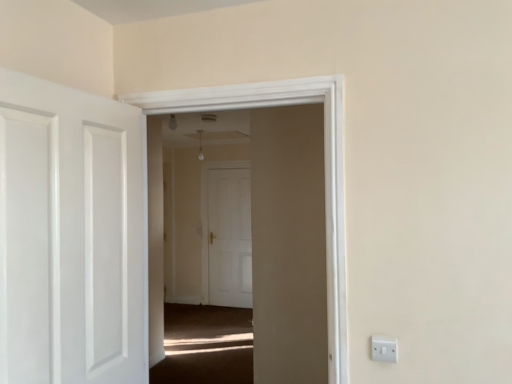
What is the approximate width of white plastic switch at lower right?

white plastic switch at lower right is 0.56 inches wide.

The image size is (512, 384). Identify the location of white matte door at center, the 2th door viewed from the front. (229, 237).

Is white glossy door at left, the 2th door from the back, aimed at white matte door at center, the 1th door viewed from the back?

No, white glossy door at left, the 2th door from the back, is not facing towards white matte door at center, the 1th door viewed from the back.

From the image's perspective, does white glossy door at left, which is the 1th door from front to back, appear lower than white matte door at center, the 2th door viewed from the front?

No, from the image's perspective, white glossy door at left, which is the 1th door from front to back, is not below white matte door at center, the 2th door viewed from the front.

In the scene shown: Can you confirm if white glossy door at left, the 2th door from the back, is positioned to the right of white matte door at center, the 2th door viewed from the front?

In fact, white glossy door at left, the 2th door from the back, is to the left of white matte door at center, the 2th door viewed from the front.

Considering the sizes of objects white glossy door at left, the 2th door from the back, and white matte door at center, the 1th door viewed from the back, in the image provided, who is thinner, white glossy door at left, the 2th door from the back, or white matte door at center, the 1th door viewed from the back,?

With smaller width is white matte door at center, the 1th door viewed from the back.

Consider the image. Between transparent glass door at center and white glossy door at left, which is the 1th door from front to back, which one has larger size?

With larger size is white glossy door at left, which is the 1th door from front to back.

This screenshot has width=512, height=384. Identify the location of window that appears on the right of white glossy door at left, which is the 1th door from front to back. (325, 166).

Can you tell me how much transparent glass door at center and white glossy door at left, the 2th door from the back, differ in facing direction?

90.8 degrees separate the facing orientations of transparent glass door at center and white glossy door at left, the 2th door from the back.

Considering the positions of point (217, 107) and point (77, 103), is point (217, 107) closer or farther from the camera than point (77, 103)?

Point (217, 107) is farther from the camera than point (77, 103).

Is transparent glass door at center a part of white matte door at center, the 2th door viewed from the front?

No, white matte door at center, the 2th door viewed from the front, does not contain transparent glass door at center.

From the picture: Who is bigger, white matte door at center, the 1th door viewed from the back, or transparent glass door at center?

With larger size is transparent glass door at center.

Which object is more forward, white matte door at center, the 2th door viewed from the front, or transparent glass door at center?

Positioned in front is transparent glass door at center.

What's the angular difference between white matte door at center, the 2th door viewed from the front, and transparent glass door at center's facing directions?

There is a 0.157-degree angle between the facing directions of white matte door at center, the 2th door viewed from the front, and transparent glass door at center.

Could white plastic switch at lower right be considered to be inside transparent glass door at center?

No, white plastic switch at lower right is not a part of transparent glass door at center.

Which object is positioned more to the left, transparent glass door at center or white plastic switch at lower right?

From the viewer's perspective, transparent glass door at center appears more on the left side.

Who is shorter, transparent glass door at center or white plastic switch at lower right?

Standing shorter between the two is white plastic switch at lower right.

How many degrees apart are the facing directions of transparent glass door at center and white plastic switch at lower right?

There is a 0.485-degree angle between the facing directions of transparent glass door at center and white plastic switch at lower right.

Considering the sizes of objects transparent glass door at center and white matte door at center, the 2th door viewed from the front, in the image provided, who is shorter, transparent glass door at center or white matte door at center, the 2th door viewed from the front,?

Standing shorter between the two is transparent glass door at center.

Between point (285, 92) and point (212, 254), which one is positioned behind?

Positioned behind is point (212, 254).

Is transparent glass door at center aimed at white matte door at center, the 1th door viewed from the back?

No, transparent glass door at center is not aimed at white matte door at center, the 1th door viewed from the back.

Is transparent glass door at center beside white matte door at center, the 2th door viewed from the front?

They are not placed beside each other.

Considering the positions of objects white matte door at center, the 1th door viewed from the back, and white glossy door at left, which is the 1th door from front to back, in the image provided, who is in front, white matte door at center, the 1th door viewed from the back, or white glossy door at left, which is the 1th door from front to back,?

white glossy door at left, which is the 1th door from front to back, is more forward.

Does point (212, 274) appear closer or farther from the camera than point (8, 378)?

Point (212, 274) is positioned farther from the camera compared to point (8, 378).

Would you consider white matte door at center, the 2th door viewed from the front, to be distant from white glossy door at left, the 2th door from the back?

Yes, white matte door at center, the 2th door viewed from the front, and white glossy door at left, the 2th door from the back, are quite far apart.

Is white matte door at center, the 2th door viewed from the front, not within white plastic switch at lower right?

Yes, white matte door at center, the 2th door viewed from the front, is outside of white plastic switch at lower right.

Is white matte door at center, the 2th door viewed from the front, thinner than white plastic switch at lower right?

Incorrect, the width of white matte door at center, the 2th door viewed from the front, is not less than that of white plastic switch at lower right.

You are a GUI agent. You are given a task and a screenshot of the screen. Output one action in this format:
    pyautogui.click(x=<x>, y=<y>)
    Task: Click on the electric outlet that is above the white matte door at center, the 2th door viewed from the front (from a real-world perspective)
    
    Given the screenshot: What is the action you would take?
    pyautogui.click(x=384, y=349)

How distant is white matte door at center, the 1th door viewed from the back, from white plastic switch at lower right?

white matte door at center, the 1th door viewed from the back, and white plastic switch at lower right are 4.24 meters apart.

This screenshot has height=384, width=512. Identify the location of door below the white glossy door at left, the 2th door from the back (from the image's perspective). (229, 237).

Identify the location of window located behind the white glossy door at left, the 2th door from the back. (325, 166).

Considering their positions, is white plastic switch at lower right positioned further to transparent glass door at center than white glossy door at left, the 2th door from the back?

The object further to transparent glass door at center is white plastic switch at lower right.

From the image, which object appears to be nearer to transparent glass door at center, white glossy door at left, which is the 1th door from front to back, or white plastic switch at lower right?

The object closer to transparent glass door at center is white glossy door at left, which is the 1th door from front to back.

Considering their positions, is white matte door at center, the 2th door viewed from the front, positioned further to white glossy door at left, which is the 1th door from front to back, than transparent glass door at center?

white matte door at center, the 2th door viewed from the front.

When comparing their distances from white glossy door at left, the 2th door from the back, does transparent glass door at center or white matte door at center, the 2th door viewed from the front, seem closer?

transparent glass door at center lies closer to white glossy door at left, the 2th door from the back, than the other object.

Considering their positions, is white matte door at center, the 1th door viewed from the back, positioned closer to transparent glass door at center than white glossy door at left, which is the 1th door from front to back?

The object closer to transparent glass door at center is white glossy door at left, which is the 1th door from front to back.

Based on their spatial positions, is white plastic switch at lower right or transparent glass door at center closer to white matte door at center, the 1th door viewed from the back?

transparent glass door at center is positioned closer to the anchor white matte door at center, the 1th door viewed from the back.

Looking at the image, which one is located closer to transparent glass door at center, white matte door at center, the 1th door viewed from the back, or white plastic switch at lower right?

white plastic switch at lower right is positioned closer to the anchor transparent glass door at center.

From the image, which object appears to be farther from white glossy door at left, which is the 1th door from front to back, white plastic switch at lower right or white matte door at center, the 1th door viewed from the back?

Among the two, white matte door at center, the 1th door viewed from the back, is located further to white glossy door at left, which is the 1th door from front to back.

The height and width of the screenshot is (384, 512). In order to click on window between white glossy door at left, the 2th door from the back, and white plastic switch at lower right in this screenshot , I will do `click(325, 166)`.

Locate an element on the screen. window between white glossy door at left, the 2th door from the back, and white matte door at center, the 2th door viewed from the front, from front to back is located at coordinates (325, 166).

This screenshot has height=384, width=512. What are the coordinates of `window positioned between white plastic switch at lower right and white matte door at center, the 1th door viewed from the back, from near to far` in the screenshot? It's located at (325, 166).

The height and width of the screenshot is (384, 512). Identify the location of electric outlet between white glossy door at left, which is the 1th door from front to back, and white matte door at center, the 2th door viewed from the front, along the z-axis. point(384,349).